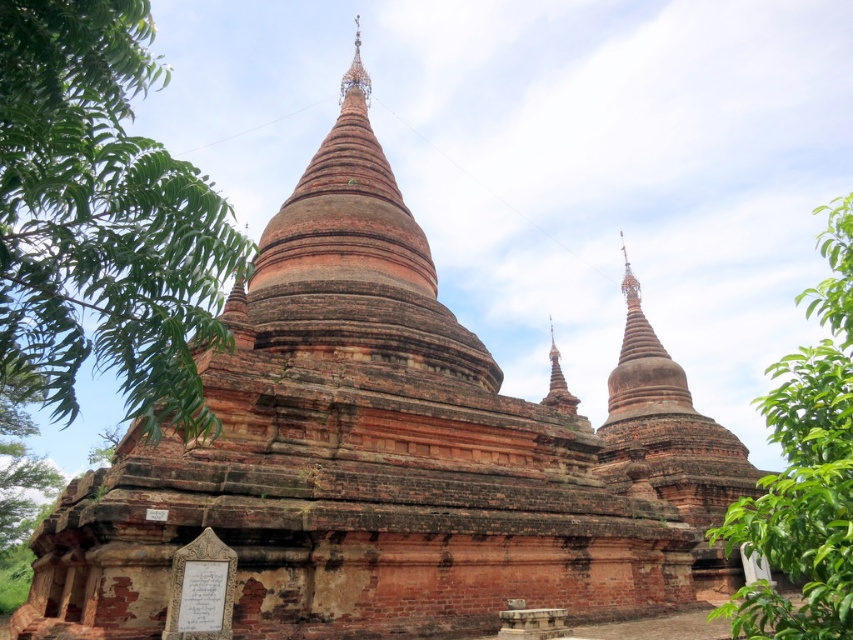
Question: Which point is farther from the camera taking this photo?

Choices:
 (A) (71, 256)
 (B) (347, 70)
 (C) (556, 385)

Answer: (B)

Question: Which of the following is the farthest from the observer?

Choices:
 (A) green leafy tree at right
 (B) green leafy tree at left

Answer: (B)

Question: Can you confirm if green leafy tree at left is positioned above green leafy tree at right?

Choices:
 (A) yes
 (B) no

Answer: (A)

Question: Can you confirm if green leafy tree at left is positioned below green leafy tree at right?

Choices:
 (A) no
 (B) yes

Answer: (A)

Question: Can you confirm if smooth reddish-brown stupa at center-right is positioned above gold metallic spire at upper center?

Choices:
 (A) yes
 (B) no

Answer: (B)

Question: Which of the following is the farthest from the observer?

Choices:
 (A) green leafy tree at left
 (B) green leafy tree at right
 (C) gold metallic spire at upper center
 (D) smooth reddish-brown stupa at center-right

Answer: (C)